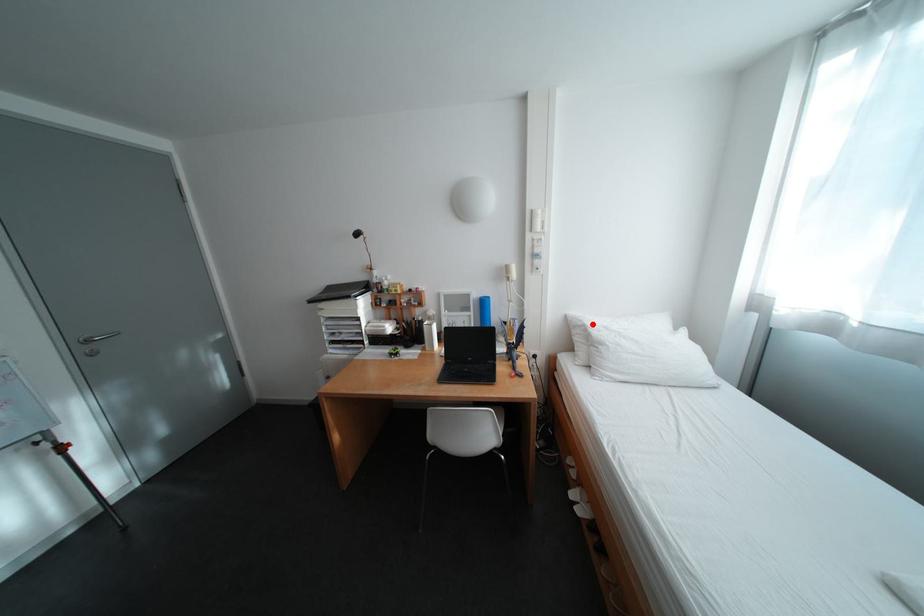
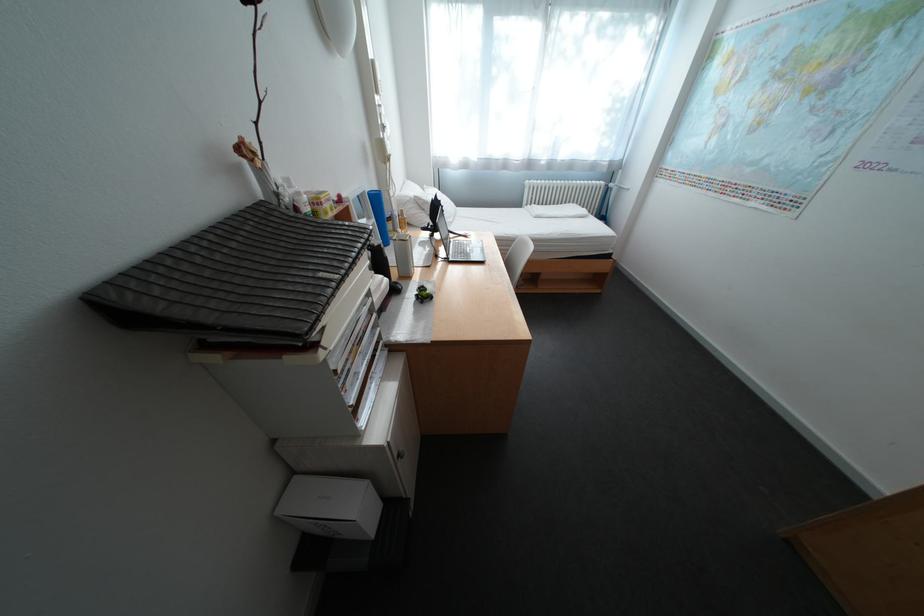
Find the pixel in the second image that matches the highlighted location in the first image.

(420, 200)